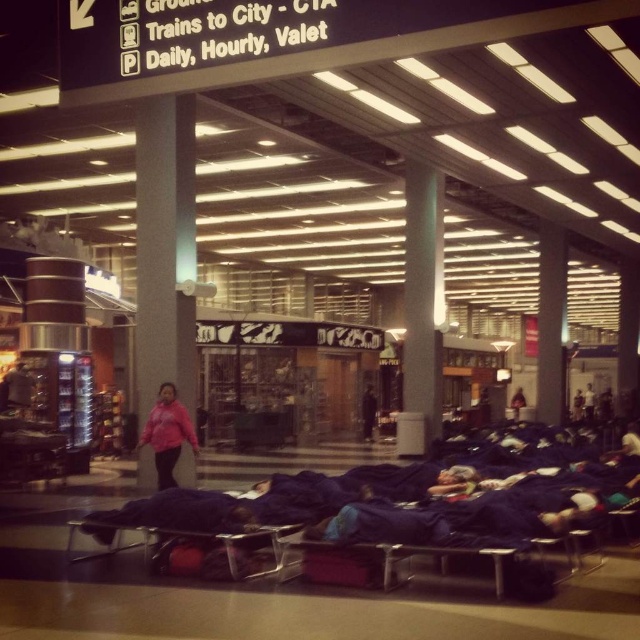
Question: Observing the image, what is the correct spatial positioning of dark blue fabric at center in reference to dark blue fabric sleeping bag at center?

Choices:
 (A) above
 (B) below

Answer: (A)

Question: Which point is closer to the camera taking this photo?

Choices:
 (A) (164, 385)
 (B) (365, 394)
 (C) (518, 394)

Answer: (A)

Question: Considering the relative positions of pink fleece jacket at center and dark blue fabric at center in the image provided, where is pink fleece jacket at center located with respect to dark blue fabric at center?

Choices:
 (A) right
 (B) left

Answer: (B)

Question: Which object appears closest to the camera in this image?

Choices:
 (A) pink fleece jacket at center
 (B) dark blue fabric at center

Answer: (A)

Question: Can you confirm if pink fleece jacket at center is bigger than dark blue fabric at center?

Choices:
 (A) yes
 (B) no

Answer: (A)

Question: Which point is closer to the camera?

Choices:
 (A) pos(513,410)
 (B) pos(364,403)

Answer: (B)